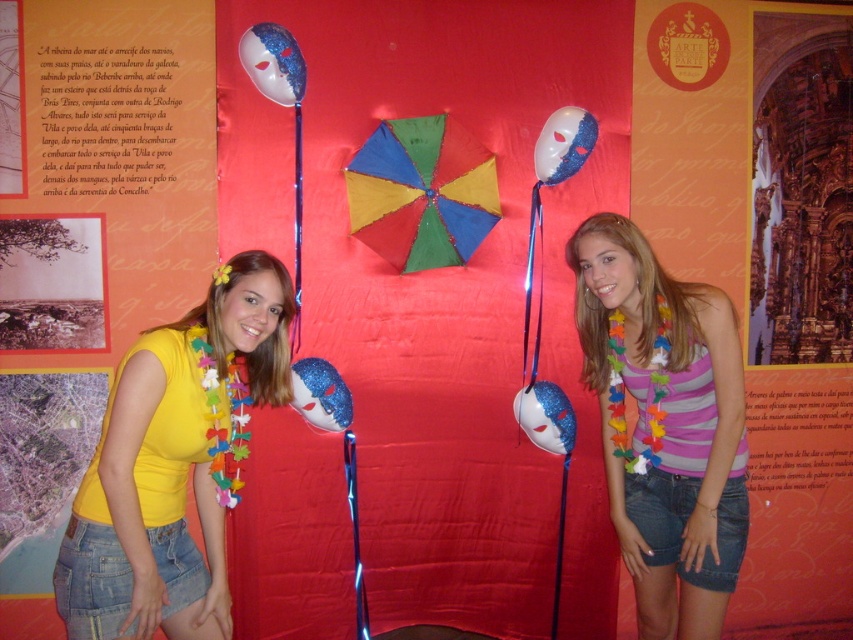
Between striped jersey at center and blue glossy mask at center, which one is positioned higher?

striped jersey at center is above.

Does striped jersey at center come behind blue glossy mask at center?

No.

This screenshot has height=640, width=853. What are the coordinates of `striped jersey at center` in the screenshot? It's located at (665, 426).

Does yellow fabric top at center have a lesser height compared to multicolored paper umbrella at center?

No.

What do you see at coordinates (169, 467) in the screenshot? I see `yellow fabric top at center` at bounding box center [169, 467].

Identify the location of yellow fabric top at center. (169, 467).

Is point (280, 61) more distant than point (303, 381)?

No.

Is point (265, 83) closer to viewer compared to point (294, 406)?

Yes, point (265, 83) is in front of point (294, 406).

Is point (299, 81) more distant than point (318, 401)?

No, (299, 81) is closer to viewer.

Find the location of a particular element. This screenshot has height=640, width=853. shiny blue mask at center is located at coordinates (273, 61).